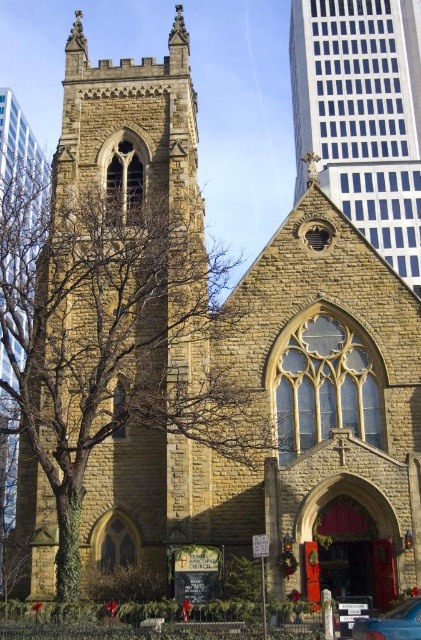
In the scene shown: Is brown stone tree at left to the left of metallic blue car at lower right from the viewer's perspective?

Correct, you'll find brown stone tree at left to the left of metallic blue car at lower right.

Is point (53, 337) closer to camera compared to point (372, 620)?

No, it is behind (372, 620).

This screenshot has height=640, width=421. Identify the location of brown stone tree at left. pyautogui.click(x=117, y=337).

Does stone church tower at center have a lesser height compared to metallic blue car at lower right?

No.

Between stone church tower at center and metallic blue car at lower right, which one is positioned lower?

metallic blue car at lower right

Is point (290, 32) positioned behind point (372, 618)?

Yes, point (290, 32) is behind point (372, 618).

Locate an element on the screen. The image size is (421, 640). stone church tower at center is located at coordinates (362, 116).

Measure the distance between brown stone tree at left and stone church tower at center.

A distance of 52.16 meters exists between brown stone tree at left and stone church tower at center.

Does brown stone tree at left have a lesser height compared to stone church tower at center?

Correct, brown stone tree at left is not as tall as stone church tower at center.

Is point (160, 220) positioned in front of point (306, 140)?

Yes, it is.

Where is `brown stone tree at left`? brown stone tree at left is located at coordinates (117, 337).